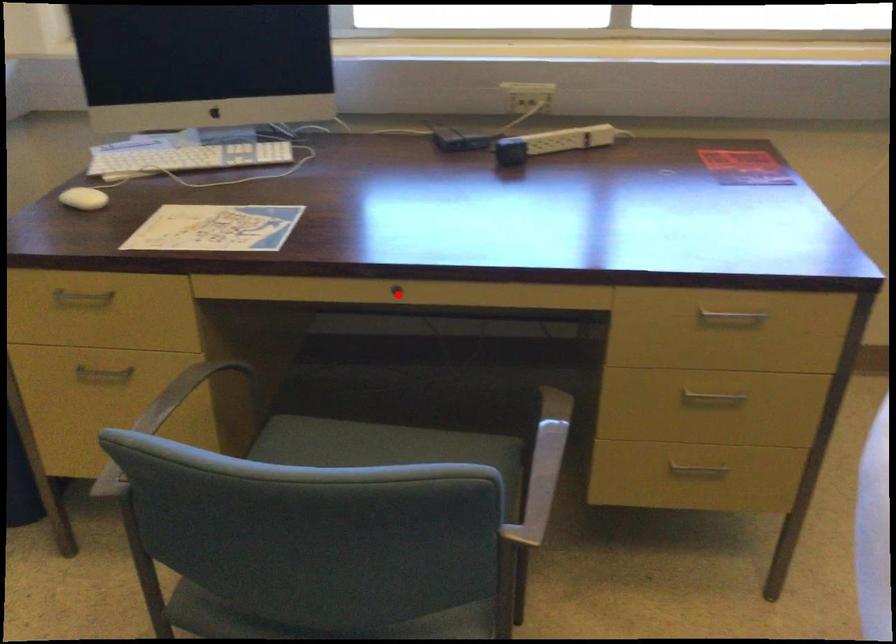
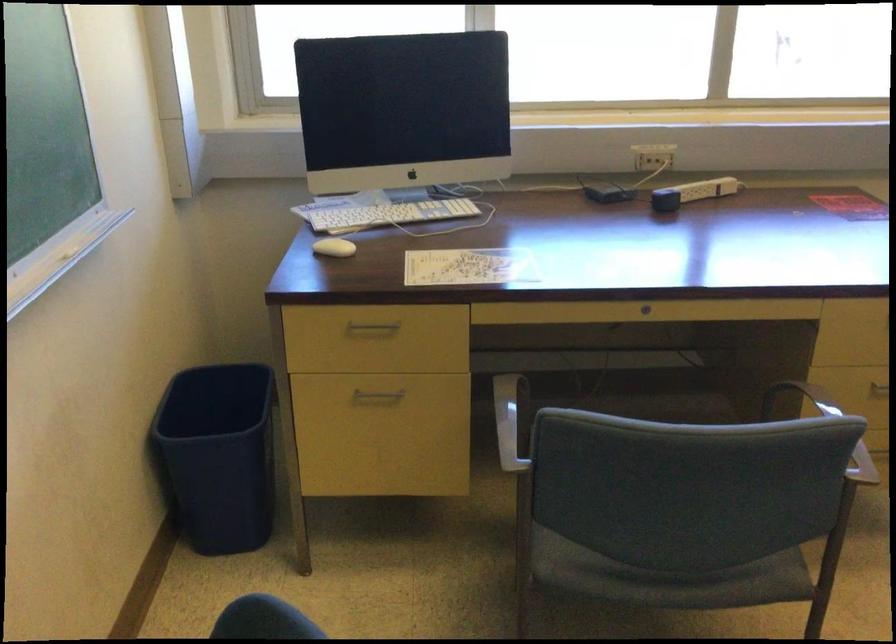
In the second image, find the point that corresponds to the highlighted location in the first image.

(645, 308)